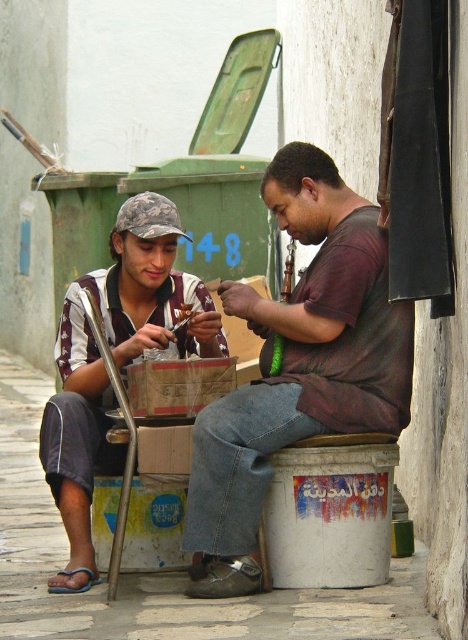
Looking at this image, based on the coordinates provided, which object is exactly at point (x=298, y=365)?

The dark brown leather shirt at center is exactly at point (x=298, y=365).

You are a fashion designer observing two people in an alleyway. You notice the dark brown leather shirt at center and the camouflage fabric cap at left. Which of these two items is taller?

The dark brown leather shirt at center is taller than the camouflage fabric cap at left according to the description.

You are a tailor who needs to determine which item requires more fabric to repair between the dark brown leather shirt at center and the camouflage fabric cap at left. Which item would you prioritize for fabric allocation?

The dark brown leather shirt at center requires more fabric for repair since its width is larger than the camouflage fabric cap at left.